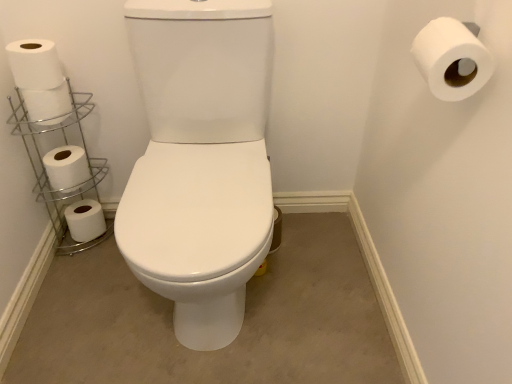
Locate an element on the screen. This screenshot has width=512, height=384. white matte toilet paper at left, the 4th toilet paper from the front is located at coordinates (66, 166).

At what (x,y) coordinates should I click in order to perform the action: click on white matte toilet paper at lower left, the first toilet paper from the left. Please return your answer as a coordinate pair (x, y). This screenshot has height=384, width=512. Looking at the image, I should click on (85, 220).

How much space does white matte toilet paper at left, which is the third toilet paper in right-to-left order, occupy horizontally?

The width of white matte toilet paper at left, which is the third toilet paper in right-to-left order, is 4.15 inches.

Identify the location of silver/metallic toilet paper holder at left. The width and height of the screenshot is (512, 384). (46, 168).

Describe the element at coordinates (46, 168) in the screenshot. The image size is (512, 384). I see `silver/metallic toilet paper holder at left` at that location.

Image resolution: width=512 pixels, height=384 pixels. What do you see at coordinates (35, 64) in the screenshot?
I see `white matte toilet paper at left, placed as the 2th toilet paper when sorted from front to back` at bounding box center [35, 64].

In order to click on white matte toilet paper at upper right, the fifth toilet paper viewed from the left in this screenshot , I will do `click(452, 58)`.

From a real-world perspective, between white matte toilet paper at left, placed as the 2th toilet paper when sorted from front to back, and silver/metallic toilet paper holder at left, who is vertically lower?

From a 3D spatial view, silver/metallic toilet paper holder at left is below.

From the image's perspective, is white matte toilet paper at left, which appears as the 4th toilet paper when viewed from the back, positioned above or below silver/metallic toilet paper holder at left?

From the image's perspective, white matte toilet paper at left, which appears as the 4th toilet paper when viewed from the back, appears above silver/metallic toilet paper holder at left.

Is white matte toilet paper at left, which appears as the 4th toilet paper when viewed from the back, with silver/metallic toilet paper holder at left?

No, white matte toilet paper at left, which appears as the 4th toilet paper when viewed from the back, is not in contact with silver/metallic toilet paper holder at left.

Is white matte toilet paper at left, placed as the 2th toilet paper when sorted from front to back, aimed at silver/metallic toilet paper holder at left?

No, white matte toilet paper at left, placed as the 2th toilet paper when sorted from front to back, is not aimed at silver/metallic toilet paper holder at left.

Does white matte toilet paper at left, the 3th toilet paper when ordered from left to right, have a lesser width compared to white matte toilet paper at left, which appears as the fourth toilet paper when viewed from the left?

Yes.

Does point (69, 111) lie behind point (51, 63)?

Yes, it is behind point (51, 63).

Can you confirm if white matte toilet paper at left, acting as the third toilet paper starting from the back, is positioned to the right of white matte toilet paper at left, which appears as the fourth toilet paper when viewed from the left?

In fact, white matte toilet paper at left, acting as the third toilet paper starting from the back, is to the left of white matte toilet paper at left, which appears as the fourth toilet paper when viewed from the left.

Based on the photo, is white matte toilet paper at left, the 3th toilet paper when ordered from left to right, bigger or smaller than white matte toilet paper at left, which appears as the fourth toilet paper when viewed from the left?

white matte toilet paper at left, the 3th toilet paper when ordered from left to right, is smaller than white matte toilet paper at left, which appears as the fourth toilet paper when viewed from the left.

Is white matte toilet paper at left, which is the second toilet paper from right to left, next to white matte toilet paper at lower left, marked as the fifth toilet paper in a right-to-left arrangement?

No, white matte toilet paper at left, which is the second toilet paper from right to left, is not in contact with white matte toilet paper at lower left, marked as the fifth toilet paper in a right-to-left arrangement.

Is white matte toilet paper at left, which appears as the 4th toilet paper when viewed from the back, positioned behind white matte toilet paper at lower left, the first toilet paper from the left?

No, it is not.

Between point (42, 52) and point (105, 231), which one is positioned in front?

The point (42, 52) is closer to the camera.

What's the angular difference between white matte toilet paper at left, which appears as the fourth toilet paper when viewed from the left, and white matte toilet paper at lower left, marked as the fifth toilet paper in a right-to-left arrangement,'s facing directions?

white matte toilet paper at left, which appears as the fourth toilet paper when viewed from the left, and white matte toilet paper at lower left, marked as the fifth toilet paper in a right-to-left arrangement, are facing 0.00528 degrees away from each other.

Considering the points (42, 183) and (449, 64), which point is in front, point (42, 183) or point (449, 64)?

The point (449, 64) is closer to the camera.

Is silver/metallic toilet paper holder at left to the left or to the right of white matte toilet paper at upper right, positioned as the 5th toilet paper in back-to-front order, in the image?

Clearly, silver/metallic toilet paper holder at left is on the left of white matte toilet paper at upper right, positioned as the 5th toilet paper in back-to-front order, in the image.

Is silver/metallic toilet paper holder at left aimed at white matte toilet paper at upper right, placed as the 1th toilet paper when sorted from right to left?

No, silver/metallic toilet paper holder at left does not turn towards white matte toilet paper at upper right, placed as the 1th toilet paper when sorted from right to left.

From a real-world perspective, which object rests below the other?

In real-world perspective, silver/metallic toilet paper holder at left is lower.

From the image's perspective, would you say white matte toilet paper at left, positioned as the third toilet paper in front-to-back order, is shown under silver/metallic toilet paper holder at left?

Incorrect, from the image's perspective, white matte toilet paper at left, positioned as the third toilet paper in front-to-back order, is higher than silver/metallic toilet paper holder at left.

Is white matte toilet paper at left, positioned as the third toilet paper in front-to-back order, taller or shorter than silver/metallic toilet paper holder at left?

Considering their sizes, white matte toilet paper at left, positioned as the third toilet paper in front-to-back order, has less height than silver/metallic toilet paper holder at left.

What's the angular difference between white matte toilet paper at left, positioned as the third toilet paper in front-to-back order, and silver/metallic toilet paper holder at left's facing directions?

The angle between the facing direction of white matte toilet paper at left, positioned as the third toilet paper in front-to-back order, and the facing direction of silver/metallic toilet paper holder at left is 0.00478 degrees.

Where is `shelf on the left of white matte toilet paper at left, the 3th toilet paper when ordered from left to right`? shelf on the left of white matte toilet paper at left, the 3th toilet paper when ordered from left to right is located at coordinates (46, 168).

Considering the sizes of white matte toilet paper at left, which is the second toilet paper from right to left, and white matte toilet paper at upper right, positioned as the 5th toilet paper in back-to-front order, in the image, is white matte toilet paper at left, which is the second toilet paper from right to left, wider or thinner than white matte toilet paper at upper right, positioned as the 5th toilet paper in back-to-front order,?

Considering their sizes, white matte toilet paper at left, which is the second toilet paper from right to left, looks slimmer than white matte toilet paper at upper right, positioned as the 5th toilet paper in back-to-front order.

From a real-world perspective, who is located lower, white matte toilet paper at left, which appears as the 4th toilet paper when viewed from the back, or white matte toilet paper at upper right, positioned as the 5th toilet paper in back-to-front order?

white matte toilet paper at left, which appears as the 4th toilet paper when viewed from the back, from a real-world perspective.

From the image's perspective, is white matte toilet paper at left, which is the second toilet paper from right to left, above or below white matte toilet paper at upper right, positioned as the 5th toilet paper in back-to-front order?

white matte toilet paper at left, which is the second toilet paper from right to left, is situated higher than white matte toilet paper at upper right, positioned as the 5th toilet paper in back-to-front order, in the image.

Based on their positions, is white matte toilet paper at left, which is the second toilet paper from right to left, located to the left or right of white matte toilet paper at upper right, positioned as the 5th toilet paper in back-to-front order?

In the image, white matte toilet paper at left, which is the second toilet paper from right to left, appears on the left side of white matte toilet paper at upper right, positioned as the 5th toilet paper in back-to-front order.

Considering their positions, is white matte toilet paper at lower left, the 1th toilet paper viewed from the back, located in front of or behind white matte toilet paper at upper right, the fifth toilet paper viewed from the left?

Visually, white matte toilet paper at lower left, the 1th toilet paper viewed from the back, is located behind white matte toilet paper at upper right, the fifth toilet paper viewed from the left.

Is white matte toilet paper at lower left, the 5th toilet paper when ordered from front to back, taller or shorter than white matte toilet paper at upper right, placed as the 1th toilet paper when sorted from right to left?

white matte toilet paper at lower left, the 5th toilet paper when ordered from front to back, is shorter than white matte toilet paper at upper right, placed as the 1th toilet paper when sorted from right to left.

Based on their positions, is white matte toilet paper at lower left, marked as the fifth toilet paper in a right-to-left arrangement, located to the left or right of white matte toilet paper at upper right, the first toilet paper viewed from the front?

Clearly, white matte toilet paper at lower left, marked as the fifth toilet paper in a right-to-left arrangement, is on the left of white matte toilet paper at upper right, the first toilet paper viewed from the front, in the image.

In order to click on toilet paper that is the 4th object located in front of the white matte toilet paper at lower left, the 5th toilet paper when ordered from front to back in this screenshot , I will do `click(452, 58)`.

From the image's perspective, count 4th toilet papers upward from the silver/metallic toilet paper holder at left and point to it. Please provide its 2D coordinates.

[(35, 64)]

Image resolution: width=512 pixels, height=384 pixels. In order to click on toilet paper that is the 1st one below the white matte toilet paper at left, which appears as the 4th toilet paper when viewed from the back (from a real-world perspective) in this screenshot , I will do `click(48, 104)`.

From the picture: Based on their spatial positions, is white matte toilet paper at left, placed as the 2th toilet paper when sorted from front to back, or silver/metallic toilet paper holder at left further from white matte toilet paper at upper right, positioned as the 5th toilet paper in back-to-front order?

The object further to white matte toilet paper at upper right, positioned as the 5th toilet paper in back-to-front order, is silver/metallic toilet paper holder at left.

Which object lies further to the anchor point white matte toilet paper at lower left, marked as the fifth toilet paper in a right-to-left arrangement, silver/metallic toilet paper holder at left or white matte toilet paper at left, placed as the 2th toilet paper when sorted from front to back?

The object further to white matte toilet paper at lower left, marked as the fifth toilet paper in a right-to-left arrangement, is white matte toilet paper at left, placed as the 2th toilet paper when sorted from front to back.

From the image, which object appears to be nearer to white matte toilet paper at lower left, marked as the fifth toilet paper in a right-to-left arrangement, white matte toilet paper at upper right, placed as the 1th toilet paper when sorted from right to left, or silver/metallic toilet paper holder at left?

silver/metallic toilet paper holder at left lies closer to white matte toilet paper at lower left, marked as the fifth toilet paper in a right-to-left arrangement, than the other object.

Based on their spatial positions, is white matte toilet paper at left, which is the second toilet paper from back to front, or silver/metallic toilet paper holder at left further from white matte toilet paper at lower left, the 1th toilet paper viewed from the back?

Among the two, white matte toilet paper at left, which is the second toilet paper from back to front, is located further to white matte toilet paper at lower left, the 1th toilet paper viewed from the back.

Estimate the real-world distances between objects in this image. Which object is further from white matte toilet paper at left, which is the second toilet paper from right to left, silver/metallic toilet paper holder at left or white matte toilet paper at left, the 4th toilet paper from the front?

silver/metallic toilet paper holder at left.

From the picture: Looking at the image, which one is located closer to white matte toilet paper at left, which is the second toilet paper from back to front, white matte toilet paper at upper right, placed as the 1th toilet paper when sorted from right to left, or white matte toilet paper at left, positioned as the third toilet paper in front-to-back order?

white matte toilet paper at left, positioned as the third toilet paper in front-to-back order, is closer to white matte toilet paper at left, which is the second toilet paper from back to front.

Considering their positions, is silver/metallic toilet paper holder at left positioned further to white matte toilet paper at left, which appears as the 4th toilet paper when viewed from the back, than white matte toilet paper at lower left, the first toilet paper from the left?

white matte toilet paper at lower left, the first toilet paper from the left, lies further to white matte toilet paper at left, which appears as the 4th toilet paper when viewed from the back, than the other object.

Estimate the real-world distances between objects in this image. Which object is further from white matte toilet paper at left, which appears as the fourth toilet paper when viewed from the left, white matte toilet paper at left, acting as the third toilet paper starting from the back, or white matte toilet paper at left, which appears as the 4th toilet paper when viewed from the right?

The object further to white matte toilet paper at left, which appears as the fourth toilet paper when viewed from the left, is white matte toilet paper at left, which appears as the 4th toilet paper when viewed from the right.

You are a GUI agent. You are given a task and a screenshot of the screen. Output one action in this format:
    pyautogui.click(x=<x>, y=<y>)
    Task: Click on the shelf between white matte toilet paper at lower left, the first toilet paper from the left, and white matte toilet paper at upper right, the first toilet paper viewed from the front
    
    Given the screenshot: What is the action you would take?
    pyautogui.click(x=46, y=168)

This screenshot has height=384, width=512. In order to click on shelf between white matte toilet paper at left, which is the third toilet paper in right-to-left order, and white matte toilet paper at lower left, the 5th toilet paper when ordered from front to back, vertically in this screenshot , I will do `click(46, 168)`.

Locate an element on the screen. The image size is (512, 384). shelf between white matte toilet paper at left, which appears as the 4th toilet paper when viewed from the right, and white matte toilet paper at upper right, the first toilet paper viewed from the front, from left to right is located at coordinates (46, 168).

This screenshot has height=384, width=512. In order to click on toilet paper between white matte toilet paper at left, the 3th toilet paper when ordered from left to right, and white matte toilet paper at upper right, the fifth toilet paper viewed from the left, in the horizontal direction in this screenshot , I will do `click(35, 64)`.